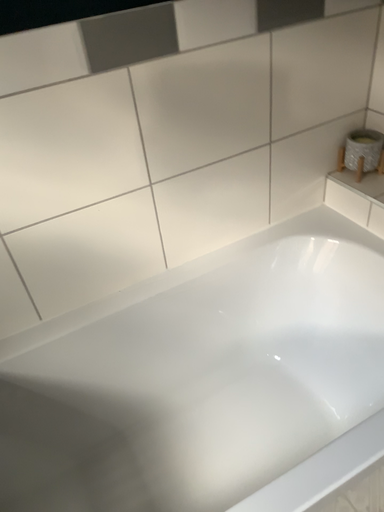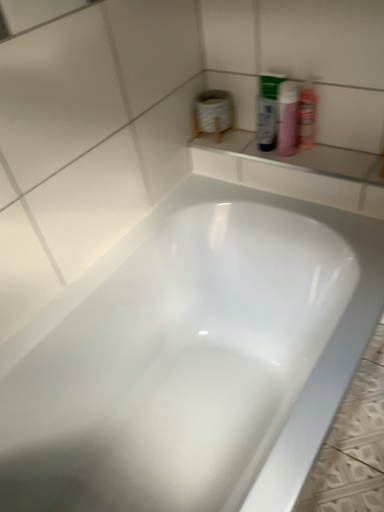
Question: Which way did the camera rotate in the video?

Choices:
 (A) rotated right
 (B) rotated left

Answer: (A)